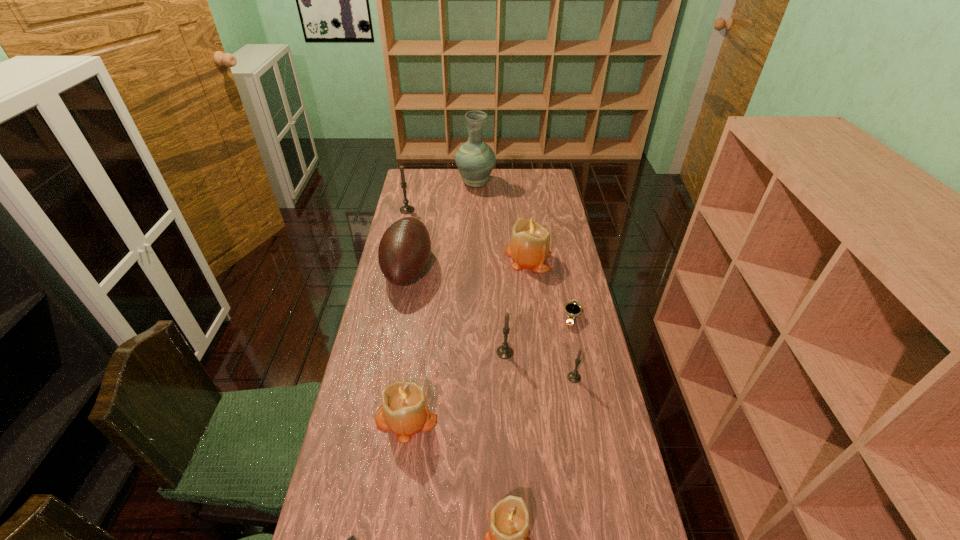
Locate an element on the screen. Image resolution: width=960 pixels, height=540 pixels. the third nearest object is located at coordinates (404, 410).

The image size is (960, 540). I want to click on the fourth farthest candle, so click(574, 377).

Image resolution: width=960 pixels, height=540 pixels. What are the coordinates of `the smallest gray candle` in the screenshot? It's located at (574, 377).

Where is `the fifth farthest object`? The image size is (960, 540). the fifth farthest object is located at coordinates (572, 309).

Where is `the second shortest object`? This screenshot has width=960, height=540. the second shortest object is located at coordinates (572, 309).

I want to click on free region located 0.250m on the right of the farthest gray candle, so click(469, 210).

The height and width of the screenshot is (540, 960). What are the coordinates of `vacant space situated on the back of the farthest beige candle` in the screenshot? It's located at [522, 210].

I want to click on vacant area situated 0.130m on the back of the football (American), so coord(417,223).

Image resolution: width=960 pixels, height=540 pixels. I want to click on vacant space located on the right of the second nearest gray candle, so click(x=576, y=352).

This screenshot has width=960, height=540. Find the location of `vacant space located on the back of the leftmost beige candle`. vacant space located on the back of the leftmost beige candle is located at coordinates (420, 318).